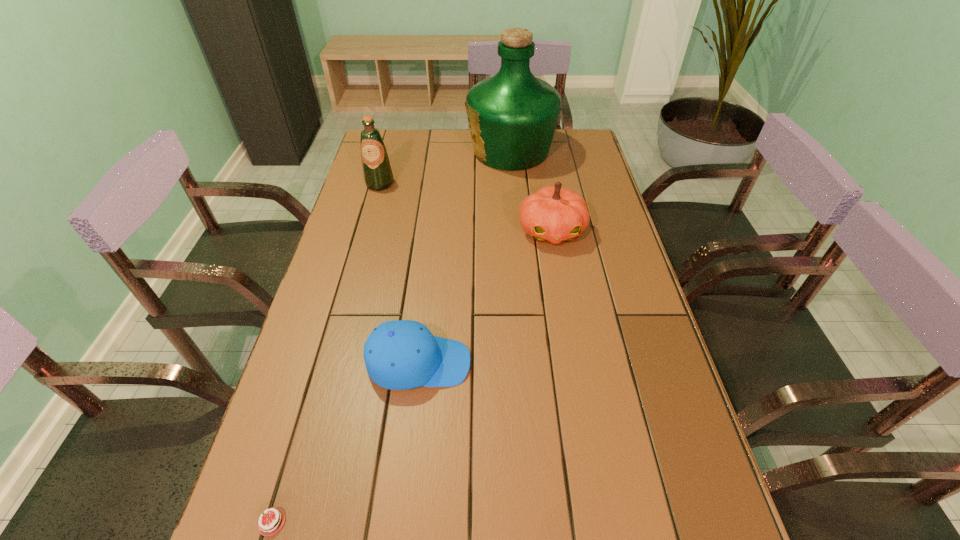
This screenshot has width=960, height=540. I want to click on vacant area at the far left corner of the desktop, so click(410, 145).

Locate an element on the screen. Image resolution: width=960 pixels, height=540 pixels. free space between the third tallest object and the tallest object is located at coordinates (531, 191).

Locate an element on the screen. Image resolution: width=960 pixels, height=540 pixels. vacant space that's between the fourth farthest object and the third farthest object is located at coordinates (485, 296).

Where is `vacant space that is in between the third shortest object and the tallest object`? vacant space that is in between the third shortest object and the tallest object is located at coordinates (531, 191).

This screenshot has width=960, height=540. Find the location of `free space that is in between the third nearest object and the olive oil`. free space that is in between the third nearest object and the olive oil is located at coordinates point(466,207).

At what (x,y) coordinates should I click in order to perform the action: click on vacant space that's between the liquor and the olive oil. Please return your answer as a coordinate pair (x, y). This screenshot has height=540, width=960. Looking at the image, I should click on (445, 167).

Where is `vacant area between the pumpkin and the olive oil`? vacant area between the pumpkin and the olive oil is located at coordinates (466, 207).

Where is `object that stands as the third closest to the chocolate cake`? Image resolution: width=960 pixels, height=540 pixels. object that stands as the third closest to the chocolate cake is located at coordinates (377, 172).

Identify which object is located as the fourth nearest to the third shortest object. Please provide its 2D coordinates. Your answer should be formatted as a tuple, i.e. [(x, y)], where the tuple contains the x and y coordinates of a point satisfying the conditions above.

[(267, 539)]

Where is `vacant space that satisfies the following two spatial constraints: 1. on the front-facing side of the third nearest object; 2. on the front-facing side of the cap`? The width and height of the screenshot is (960, 540). vacant space that satisfies the following two spatial constraints: 1. on the front-facing side of the third nearest object; 2. on the front-facing side of the cap is located at coordinates (575, 363).